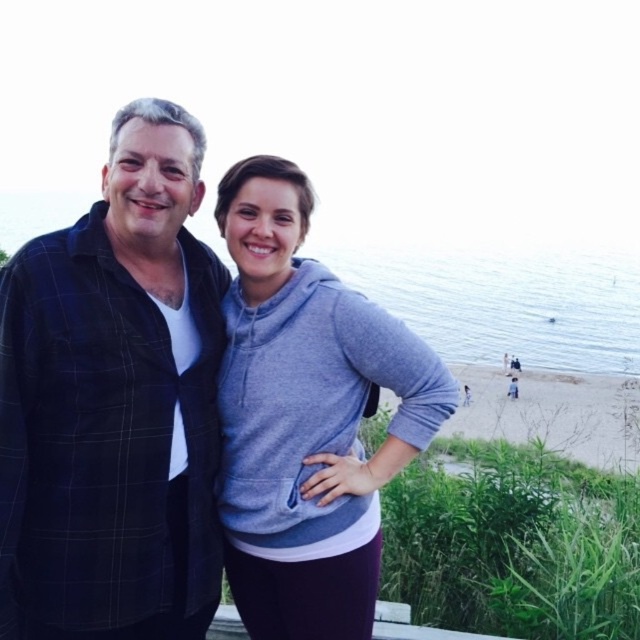
Question: Which object is closer to the camera taking this photo?

Choices:
 (A) dark blue plaid shirt at left
 (B) gray fleece hoodie at center

Answer: (A)

Question: Is dark blue plaid shirt at left to the left of gray fleece hoodie at center from the viewer's perspective?

Choices:
 (A) no
 (B) yes

Answer: (B)

Question: In this image, where is dark blue plaid shirt at left located relative to gray fleece hoodie at center?

Choices:
 (A) below
 (B) above

Answer: (B)

Question: Is dark blue plaid shirt at left wider than gray fleece hoodie at center?

Choices:
 (A) yes
 (B) no

Answer: (B)

Question: Which of the following is the closest to the observer?

Choices:
 (A) (259, 308)
 (B) (45, 492)

Answer: (B)

Question: Which of the following is the farthest from the observer?

Choices:
 (A) (340, 369)
 (B) (202, 548)

Answer: (A)